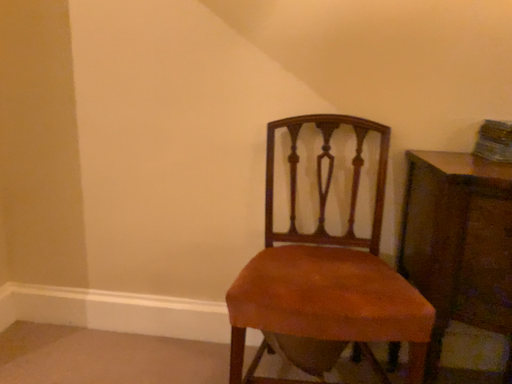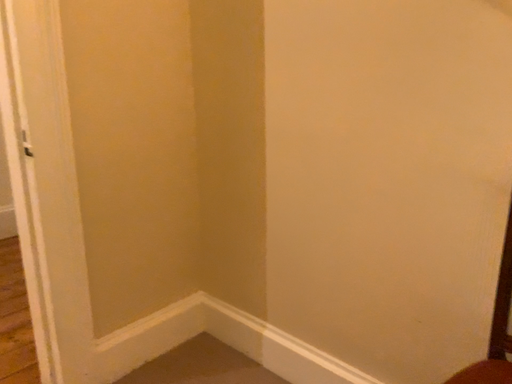
Question: Which way did the camera rotate in the video?

Choices:
 (A) rotated left
 (B) rotated right

Answer: (A)